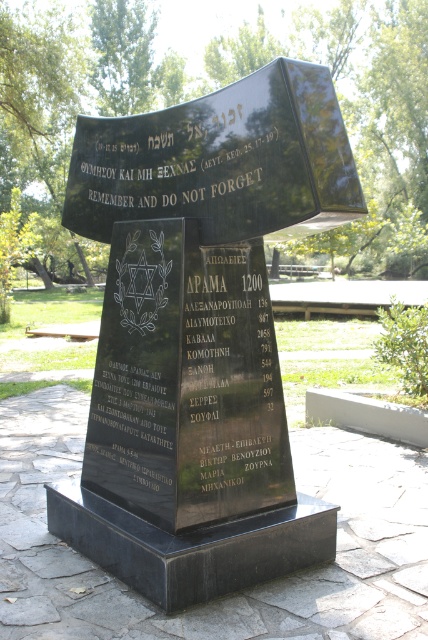
Does black polished stone monument at center have a lesser width compared to black stone plaque at center?

No, black polished stone monument at center is not thinner than black stone plaque at center.

This screenshot has width=428, height=640. I want to click on black polished stone monument at center, so click(x=199, y=333).

Is black polished stone monument at center behind black polished stone at center?

That is False.

Is black polished stone monument at center above black polished stone at center?

Correct, black polished stone monument at center is located above black polished stone at center.

In order to click on black polished stone monument at center in this screenshot , I will do `click(199, 333)`.

At what (x,y) coordinates should I click in order to perform the action: click on black polished stone monument at center. Please return your answer as a coordinate pair (x, y). This screenshot has height=640, width=428. Looking at the image, I should click on (199, 333).

Is black polished stone at center to the left of black stone plaque at center from the viewer's perspective?

Incorrect, black polished stone at center is not on the left side of black stone plaque at center.

Between black polished stone at center and black stone plaque at center, which one is positioned lower?

Positioned lower is black polished stone at center.

Between point (216, 358) and point (80, 198), which one is positioned behind?

The point (80, 198) is behind.

Where is `black polished stone at center`? The height and width of the screenshot is (640, 428). black polished stone at center is located at coordinates (228, 376).